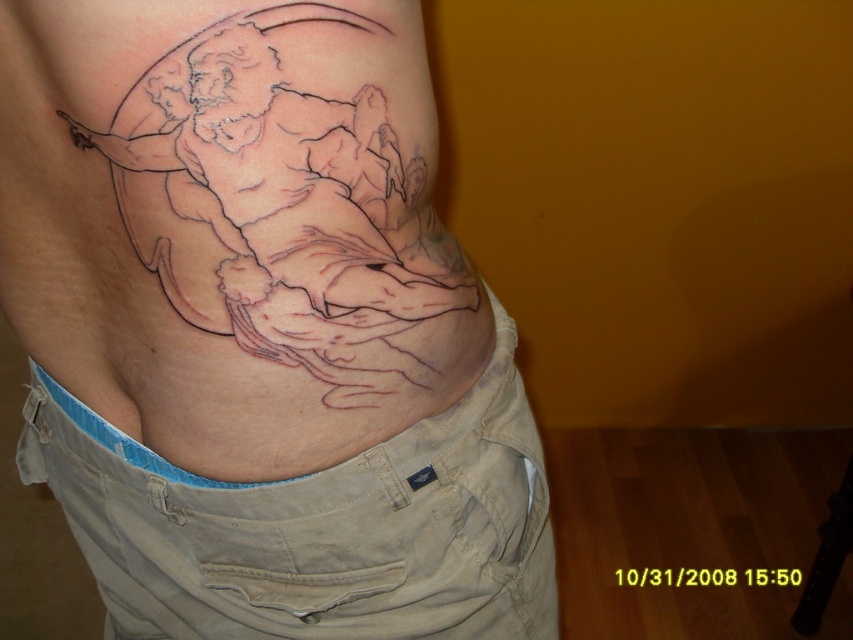
Question: Does black ink tattoo at upper center lie behind black ink tattoo at center?

Choices:
 (A) no
 (B) yes

Answer: (A)

Question: Is the position of black ink tattoo at upper center more distant than that of black ink tattoo at center?

Choices:
 (A) yes
 (B) no

Answer: (B)

Question: Which object is closer to the camera taking this photo?

Choices:
 (A) black ink tattoo at center
 (B) black ink tattoo at upper center

Answer: (B)

Question: Which point is farther to the camera?

Choices:
 (A) (421, 227)
 (B) (198, 426)

Answer: (B)

Question: Which of the following is the closest to the observer?

Choices:
 (A) (367, 364)
 (B) (178, 285)

Answer: (B)

Question: Is black ink tattoo at upper center to the right of black ink tattoo at center from the viewer's perspective?

Choices:
 (A) no
 (B) yes

Answer: (A)